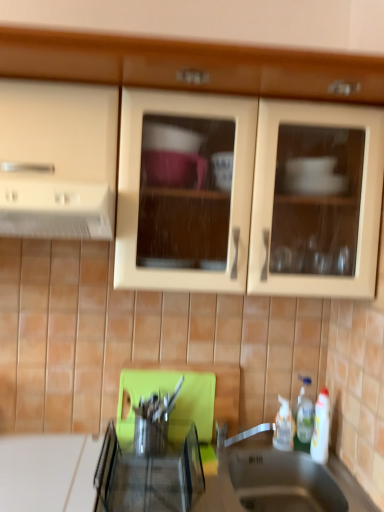
Question: From the image's perspective, is white glossy bottle at lower right, the 1th bottle positioned from the right, located beneath metallic stainless steel sink at lower center?

Choices:
 (A) no
 (B) yes

Answer: (A)

Question: Can you confirm if white glossy bottle at lower right, the 1th bottle positioned from the right, is taller than metallic stainless steel sink at lower center?

Choices:
 (A) yes
 (B) no

Answer: (A)

Question: From a real-world perspective, is white glossy bottle at lower right, which is the 2th bottle from left to right, under metallic stainless steel sink at lower center?

Choices:
 (A) no
 (B) yes

Answer: (A)

Question: Can you confirm if white glossy bottle at lower right, the 1th bottle positioned from the right, is shorter than metallic stainless steel sink at lower center?

Choices:
 (A) no
 (B) yes

Answer: (A)

Question: Is white glossy bottle at lower right, the 1th bottle positioned from the right, not close to metallic stainless steel sink at lower center?

Choices:
 (A) no
 (B) yes

Answer: (A)

Question: Relative to matte wood cabinets at upper center, is metallic stainless steel sink at lower center in front or behind?

Choices:
 (A) behind
 (B) front

Answer: (A)

Question: From a real-world perspective, is metallic stainless steel sink at lower center positioned above or below matte wood cabinets at upper center?

Choices:
 (A) below
 (B) above

Answer: (A)

Question: In terms of width, does metallic stainless steel sink at lower center look wider or thinner when compared to matte wood cabinets at upper center?

Choices:
 (A) thin
 (B) wide

Answer: (A)

Question: Would you say metallic stainless steel sink at lower center is to the left or to the right of matte wood cabinets at upper center in the picture?

Choices:
 (A) right
 (B) left

Answer: (A)

Question: Is matte wood cabinets at upper center wider or thinner than metallic stainless steel sink at lower center?

Choices:
 (A) thin
 (B) wide

Answer: (B)

Question: Does point (248, 168) appear closer or farther from the camera than point (284, 507)?

Choices:
 (A) closer
 (B) farther

Answer: (A)

Question: Considering the positions of matte wood cabinets at upper center and metallic stainless steel sink at lower center in the image, is matte wood cabinets at upper center bigger or smaller than metallic stainless steel sink at lower center?

Choices:
 (A) big
 (B) small

Answer: (A)

Question: Visually, is matte wood cabinets at upper center positioned to the left or to the right of metallic stainless steel sink at lower center?

Choices:
 (A) left
 (B) right

Answer: (A)

Question: Is point (76, 215) positioned closer to the camera than point (152, 465)?

Choices:
 (A) closer
 (B) farther

Answer: (A)

Question: From a real-world perspective, is white matte exhaust hood at left above or below metallic stainless steel knife block at center?

Choices:
 (A) below
 (B) above

Answer: (B)